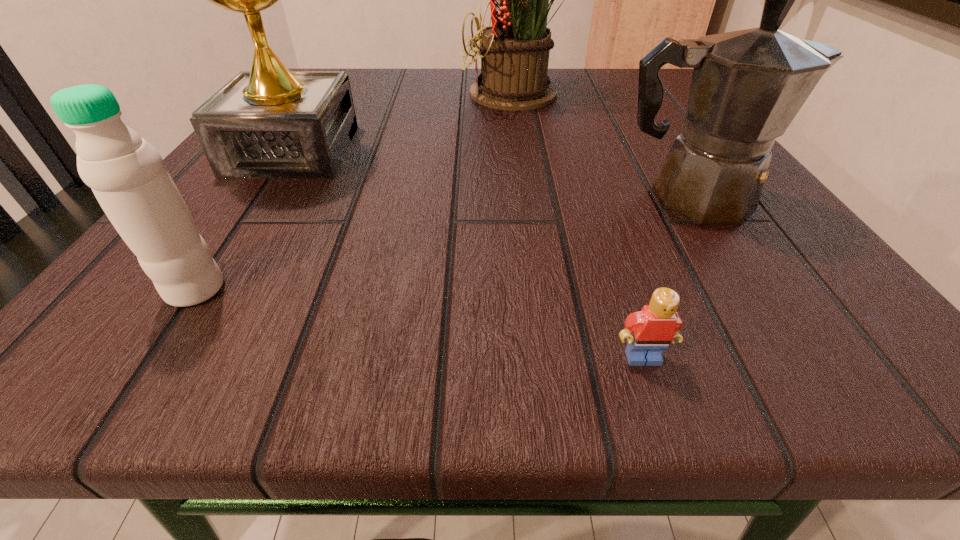
Identify the location of vacant space at the near edge of the desktop. (688, 358).

Where is `blank area at the right edge`? blank area at the right edge is located at coordinates (627, 153).

The height and width of the screenshot is (540, 960). I want to click on free region at the near left corner of the desktop, so click(184, 322).

Locate an element on the screen. Image resolution: width=960 pixels, height=540 pixels. vacant space at the far right corner of the desktop is located at coordinates (602, 87).

You are a GUI agent. You are given a task and a screenshot of the screen. Output one action in this format:
    pyautogui.click(x=<x>, y=<y>)
    Task: Click on the free space between the coffeepot and the award
    
    Given the screenshot: What is the action you would take?
    pyautogui.click(x=492, y=174)

In order to click on vacant space in between the flower arrangement and the Lego in this screenshot , I will do `click(583, 226)`.

You are a GUI agent. You are given a task and a screenshot of the screen. Output one action in this format:
    pyautogui.click(x=<x>, y=<y>)
    Task: Click on the free space between the second nearest object and the farthest object
    Image resolution: width=960 pixels, height=540 pixels.
    Given the screenshot: What is the action you would take?
    pyautogui.click(x=359, y=192)

Find the location of a particular element. This screenshot has width=960, height=540. free space between the water bottle and the farthest object is located at coordinates (359, 192).

This screenshot has height=540, width=960. Find the location of `free space between the Lego and the flower arrangement`. free space between the Lego and the flower arrangement is located at coordinates (583, 226).

Where is `vacant space that is in between the coffeepot and the water bottle`? This screenshot has height=540, width=960. vacant space that is in between the coffeepot and the water bottle is located at coordinates (444, 244).